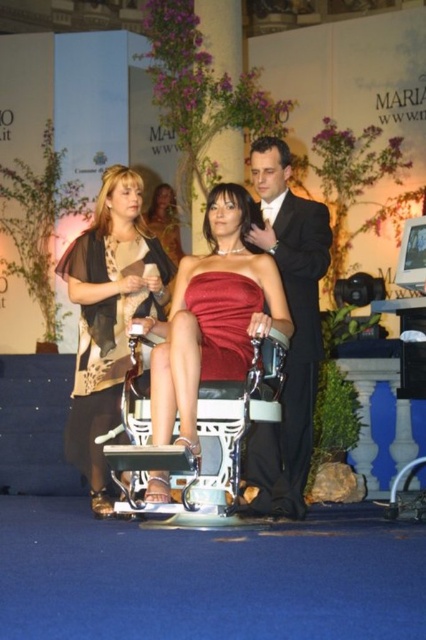
You are a photographer at a formal event. You notice two guests wearing black satin suit at center and matte black dress at center. Which one is closer to the camera based on their positions?

The black satin suit at center is closer to the camera because it is in front of the matte black dress at center.

You are a photographer at a formal event and need to position two guests for a group photo. The guests are wearing the black satin suit at center and the matte black dress at center. Since the stage has limited space, you must ensure they can stand side by side without overlapping. Can you fit both of them comfortably?

The black satin suit at center has a larger width than the matte black dress at center. To fit both comfortably side by side, position the black satin suit at center first and leave enough space for the matte black dress at center next to it, ensuring there is no overlap.

You are a photographer at a fashion show. You need to capture a photo where the matte beige dress at center is clearly visible without being obscured by the matte black dress at center. Based on the scene description, can you position yourself in a way that achieves this?

Yes, since the matte beige dress at center is in front of the matte black dress at center, positioning yourself so that you face the front side of the matte beige dress at center will ensure it is visible without obstruction from the matte black dress at center.